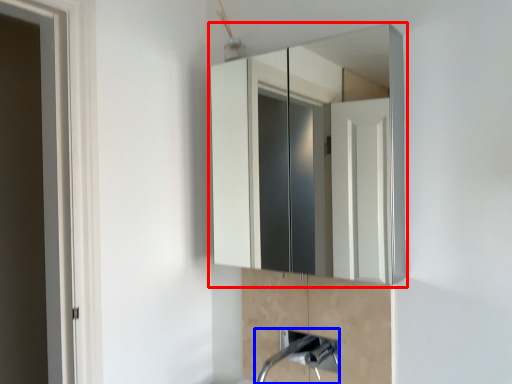
Question: Which object appears farthest to the camera in this image, medicine cabinet (highlighted by a red box) or plumbing fixture (highlighted by a blue box)?

Choices:
 (A) medicine cabinet
 (B) plumbing fixture

Answer: (B)